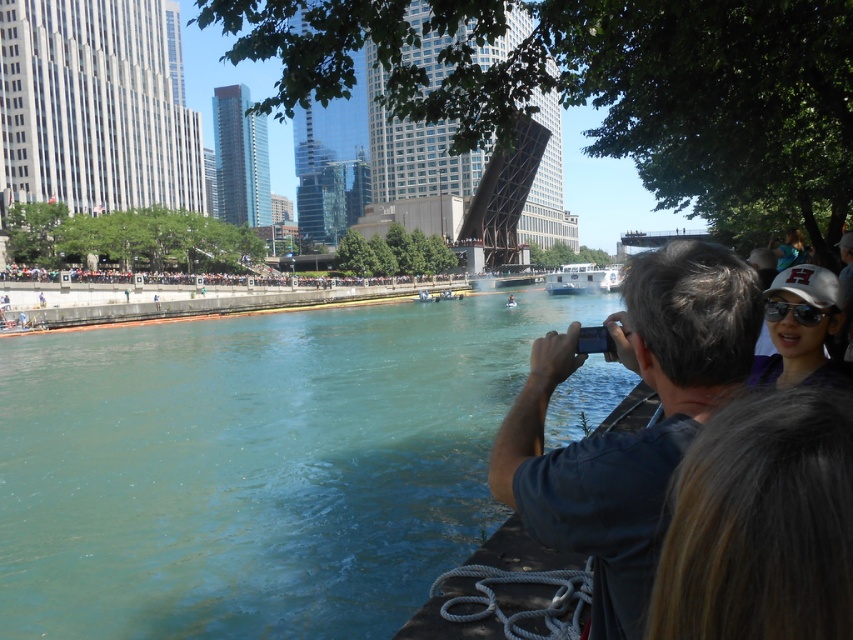
Question: Which object appears farthest from the camera in this image?

Choices:
 (A) dark blue shirt at center
 (B) white matte boat at center

Answer: (B)

Question: Is teal water at lower left to the right of blue denim jacket at upper right from the viewer's perspective?

Choices:
 (A) no
 (B) yes

Answer: (A)

Question: Considering the relative positions of teal water at lower left and dark blue shirt at center in the image provided, where is teal water at lower left located with respect to dark blue shirt at center?

Choices:
 (A) above
 (B) below

Answer: (B)

Question: Estimate the real-world distances between objects in this image. Which object is farther from the dark brown hair at upper right?

Choices:
 (A) teal water at lower left
 (B) blue denim jacket at upper right

Answer: (A)

Question: Which point appears farthest from the camera in this image?

Choices:
 (A) (791, 257)
 (B) (323, 436)

Answer: (A)

Question: Can you confirm if white matte boat at center is positioned to the left of blue denim jacket at upper right?

Choices:
 (A) no
 (B) yes

Answer: (A)